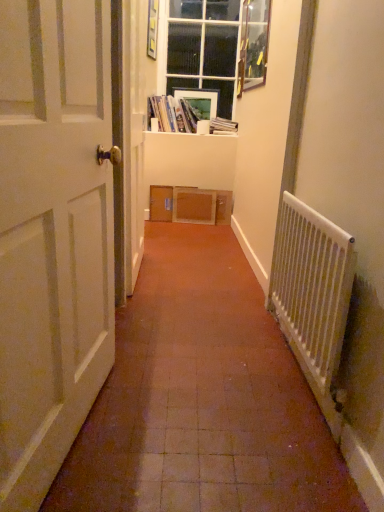
Question: Is matte plastic picture frame at upper center, arranged as the 2th picture frame when viewed from the front, taller or shorter than white matte door at left?

Choices:
 (A) tall
 (B) short

Answer: (B)

Question: From the image's perspective, is matte plastic picture frame at upper center, the 1th picture frame when ordered from back to front, positioned above or below white matte door at left?

Choices:
 (A) below
 (B) above

Answer: (B)

Question: Which object is the closest to the white plastic radiator at right?

Choices:
 (A) wooden picture frame at upper right, the first picture frame from the front
 (B) white glossy window sill at upper center
 (C) white matte door at left
 (D) matte cardboard books at upper center, placed as the 2th book when sorted from right to left
 (E) clear glass window at upper center

Answer: (C)

Question: Which object is the closest to the matte cardboard books at upper center, acting as the 1th book starting from the left?

Choices:
 (A) hardcover book at upper center, which is the first book in right-to-left order
 (B) matte plastic picture frame at upper center, the 1th picture frame when ordered from back to front
 (C) white matte door at left
 (D) wooden picture frame at upper right, acting as the 2th picture frame starting from the left
 (E) white plastic radiator at right

Answer: (B)